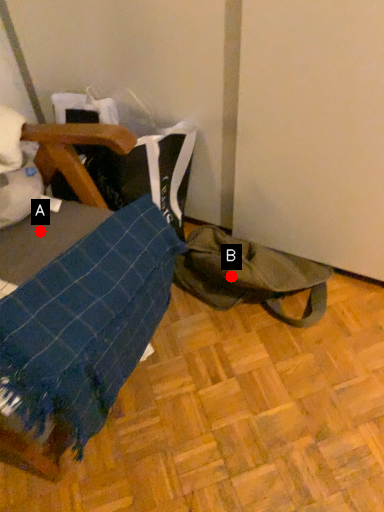
Question: Two points are circled on the image, labeled by A and B beside each circle. Which point appears farthest from the camera in this image?

Choices:
 (A) A is further
 (B) B is further

Answer: (B)